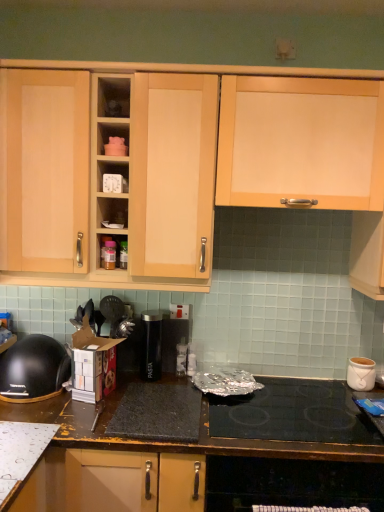
I want to click on vacant region above dark brown laminate countertop at lower center (from a real-world perspective), so click(x=221, y=403).